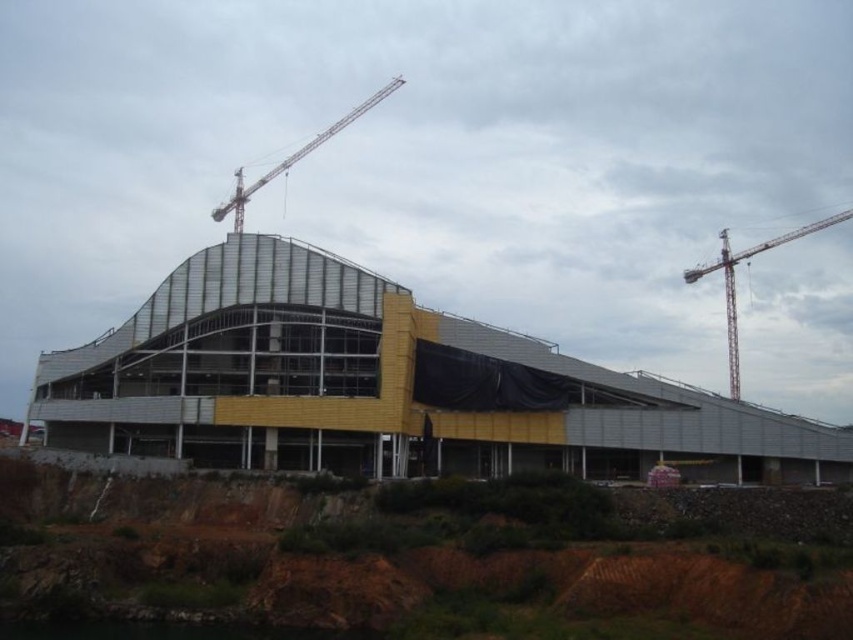
You are an architect inspecting a construction site. You notice the metallic glass building at center and the metallic gray crane at upper center. Which object appears larger in the image?

The metallic gray crane at upper center appears larger than the metallic glass building at center.

You are standing at the center of the construction site. You need to locate the metallic red crane at upper right. Which direction should you look to find it?

You should look towards the upper right direction to find the metallic red crane at upper right.

You are standing at the construction site observing the metallic glass building at center. If you have a drone that can fly up to 100 meters, can it reach the building to capture aerial footage?

The metallic glass building at center is 104.51 meters away from the viewer. Since the drone can only fly up to 100 meters, it cannot reach the building to capture aerial footage.